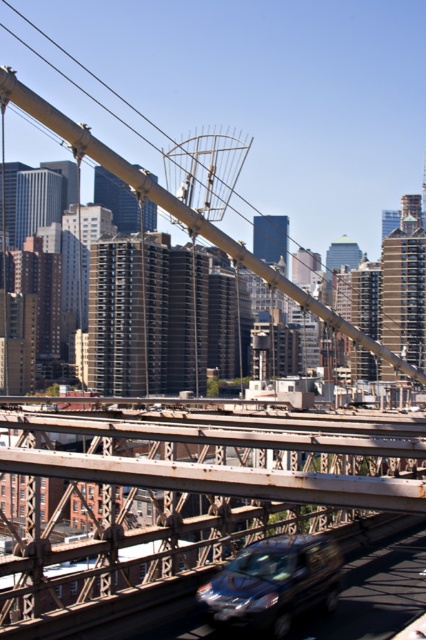
Question: Where is rusty metal bridge at center located in relation to metallic silver van at center in the image?

Choices:
 (A) above
 (B) below

Answer: (B)

Question: Is rusty metal bridge at center closer to the viewer compared to metallic silver van at center?

Choices:
 (A) yes
 (B) no

Answer: (A)

Question: Which of the following is the closest to the observer?

Choices:
 (A) (275, 550)
 (B) (233, 486)

Answer: (B)

Question: Among these objects, which one is nearest to the camera?

Choices:
 (A) rusty metal bridge at center
 (B) metallic silver van at center

Answer: (A)

Question: Can you confirm if rusty metal bridge at center is positioned to the left of metallic silver van at center?

Choices:
 (A) yes
 (B) no

Answer: (A)